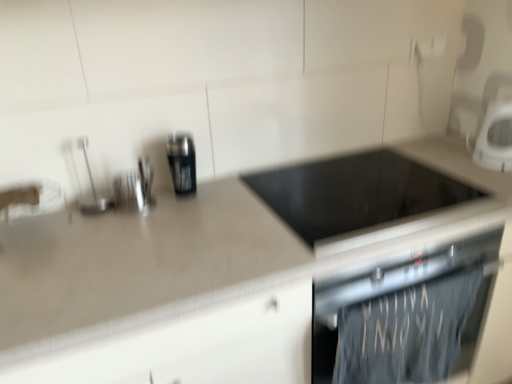
You are a GUI agent. You are given a task and a screenshot of the screen. Output one action in this format:
    pyautogui.click(x=<x>, y=<y>)
    Task: Click on the vacant area that is situated to the right of brushed metal spoon at upper left, the 3th appliance in the right-to-left sequence
    
    Given the screenshot: What is the action you would take?
    pyautogui.click(x=163, y=214)